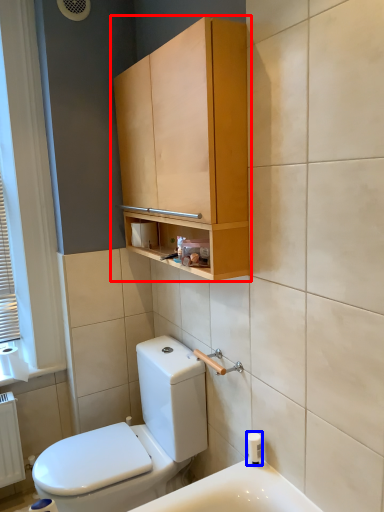
Question: Among these objects, which one is farthest to the camera, bathroom cabinet (highlighted by a red box) or toiletry (highlighted by a blue box)?

Choices:
 (A) bathroom cabinet
 (B) toiletry

Answer: (B)